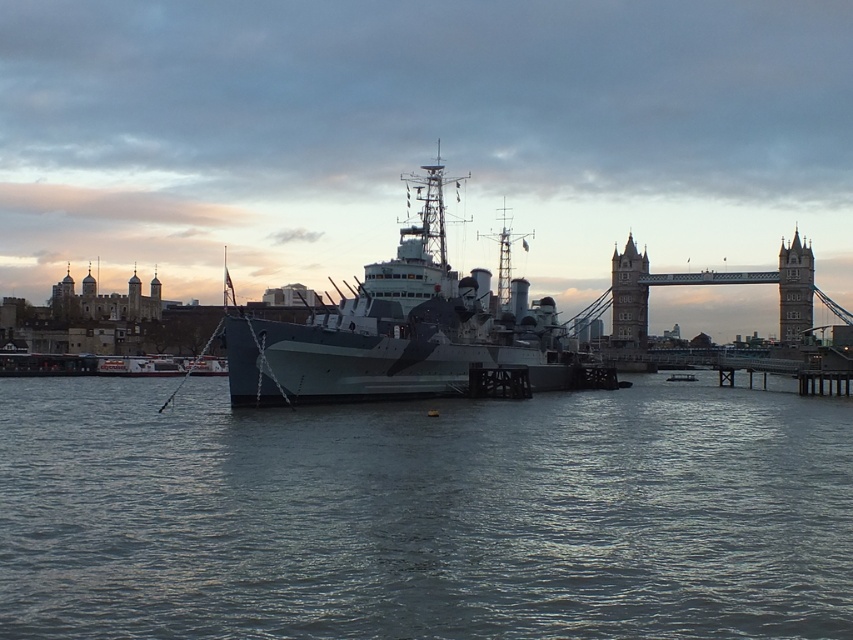
Question: Among these points, which one is nearest to the camera?

Choices:
 (A) (804, 240)
 (B) (51, 536)

Answer: (B)

Question: Which of the following is the farthest from the observer?

Choices:
 (A) (705, 481)
 (B) (329, 353)
 (C) (799, 320)
 (D) (646, 259)

Answer: (D)

Question: Is camouflage paint ship at center bigger than stone tower at center?

Choices:
 (A) no
 (B) yes

Answer: (B)

Question: Among these points, which one is nearest to the camera?

Choices:
 (A) (259, 320)
 (B) (635, 280)

Answer: (A)

Question: Does camouflage paint ship at center appear under stone tower at center?

Choices:
 (A) yes
 (B) no

Answer: (B)

Question: Does gray water at center have a larger size compared to stone tower at center?

Choices:
 (A) yes
 (B) no

Answer: (A)